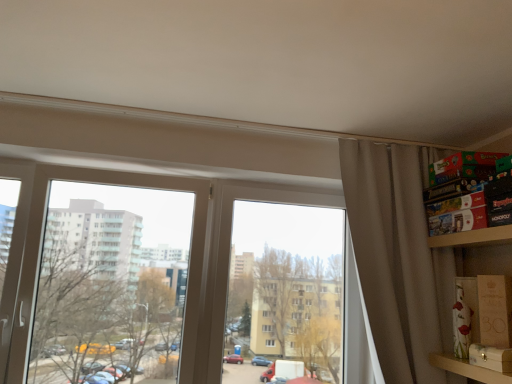
Question: Does transparent glass window at center have a larger size compared to matte brown cardboard box at lower right, which is the 2th cardboard box from front to back?

Choices:
 (A) no
 (B) yes

Answer: (B)

Question: Does transparent glass window at center have a lesser width compared to matte brown cardboard box at lower right, which is the 2th cardboard box from front to back?

Choices:
 (A) no
 (B) yes

Answer: (B)

Question: Does transparent glass window at center have a greater width compared to matte brown cardboard box at lower right, which is the 2th cardboard box from front to back?

Choices:
 (A) no
 (B) yes

Answer: (A)

Question: Does transparent glass window at center appear on the right side of matte brown cardboard box at lower right, the 1th cardboard box in the back-to-front sequence?

Choices:
 (A) no
 (B) yes

Answer: (A)

Question: From a real-world perspective, is transparent glass window at center over matte brown cardboard box at lower right, which is the 2th cardboard box from front to back?

Choices:
 (A) no
 (B) yes

Answer: (B)

Question: Is transparent glass window at center surrounding matte brown cardboard box at lower right, which is the 2th cardboard box from front to back?

Choices:
 (A) yes
 (B) no

Answer: (B)

Question: Can you confirm if beige fabric curtain at right is bigger than wooden box at right, which is the second cardboard box from back to front?

Choices:
 (A) no
 (B) yes

Answer: (B)

Question: Does beige fabric curtain at right have a lesser height compared to wooden box at right, which is the second cardboard box from back to front?

Choices:
 (A) yes
 (B) no

Answer: (B)

Question: Does beige fabric curtain at right have a lesser width compared to wooden box at right, the 1th cardboard box when ordered from front to back?

Choices:
 (A) no
 (B) yes

Answer: (A)

Question: From a real-world perspective, is beige fabric curtain at right positioned under wooden box at right, which is the second cardboard box from back to front, based on gravity?

Choices:
 (A) no
 (B) yes

Answer: (A)

Question: From the image's perspective, is beige fabric curtain at right located above wooden box at right, the 1th cardboard box when ordered from front to back?

Choices:
 (A) yes
 (B) no

Answer: (A)

Question: Considering the relative sizes of beige fabric curtain at right and wooden box at right, the 1th cardboard box when ordered from front to back, in the image provided, is beige fabric curtain at right wider than wooden box at right, the 1th cardboard box when ordered from front to back,?

Choices:
 (A) no
 (B) yes

Answer: (B)

Question: Is transparent glass window at left completely or partially inside wooden box at right, the 1th cardboard box when ordered from front to back?

Choices:
 (A) yes
 (B) no

Answer: (B)